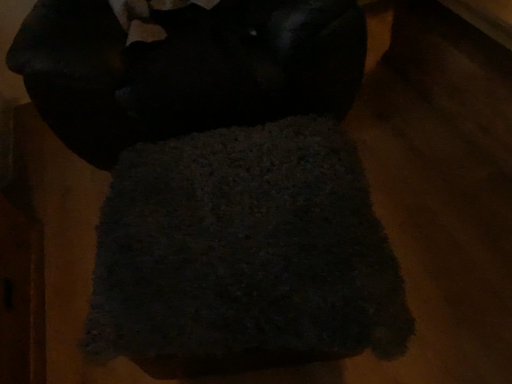
I want to click on dark textured towel at center, so click(x=243, y=255).

Describe the element at coordinates (243, 255) in the screenshot. I see `dark textured towel at center` at that location.

Where is `dark wool rug at center`? This screenshot has height=384, width=512. dark wool rug at center is located at coordinates (185, 67).

What do you see at coordinates (185, 67) in the screenshot?
I see `dark wool rug at center` at bounding box center [185, 67].

Image resolution: width=512 pixels, height=384 pixels. What are the coordinates of `dark textured towel at center` in the screenshot? It's located at (243, 255).

Is dark wool rug at center to the right of dark textured towel at center from the viewer's perspective?

In fact, dark wool rug at center is to the left of dark textured towel at center.

Which object is further away from the camera, dark wool rug at center or dark textured towel at center?

dark wool rug at center is behind.

Which is more distant, (115, 144) or (296, 297)?

The point (115, 144) is farther from the camera.

From the image's perspective, is dark wool rug at center positioned above or below dark textured towel at center?

dark wool rug at center is above dark textured towel at center.

From a real-world perspective, is dark wool rug at center positioned over dark textured towel at center based on gravity?

Correct, in the physical world, dark wool rug at center is higher than dark textured towel at center.

Does dark wool rug at center have a greater width compared to dark textured towel at center?

Yes, dark wool rug at center is wider than dark textured towel at center.

Is dark wool rug at center taller or shorter than dark textured towel at center?

dark wool rug at center is taller than dark textured towel at center.

Considering the sizes of objects dark wool rug at center and dark textured towel at center in the image provided, who is smaller, dark wool rug at center or dark textured towel at center?

dark textured towel at center.

Is dark wool rug at center inside or outside of dark textured towel at center?

The correct answer is: outside.

Is dark wool rug at center in contact with dark textured towel at center?

There is a gap between dark wool rug at center and dark textured towel at center.

Is dark wool rug at center positioned with its back to dark textured towel at center?

No, dark wool rug at center's orientation is not away from dark textured towel at center.

The width and height of the screenshot is (512, 384). There is a dark textured towel at center. Find the location of `wool above it (from a real-world perspective)`. wool above it (from a real-world perspective) is located at coordinates (185, 67).

Is dark textured towel at center to the right of dark wool rug at center from the viewer's perspective?

Indeed, dark textured towel at center is positioned on the right side of dark wool rug at center.

Relative to dark wool rug at center, is dark textured towel at center in front or behind?

dark textured towel at center is positioned closer to the viewer than dark wool rug at center.

Does point (124, 227) lie in front of point (216, 35)?

Yes, it is in front of point (216, 35).

From the image's perspective, is dark textured towel at center over dark wool rug at center?

No, from the image's perspective, dark textured towel at center is not over dark wool rug at center.

From the picture: From a real-world perspective, is dark textured towel at center physically below dark wool rug at center?

Yes.

Considering the relative sizes of dark textured towel at center and dark wool rug at center in the image provided, is dark textured towel at center thinner than dark wool rug at center?

Yes.

From their relative heights in the image, would you say dark textured towel at center is taller or shorter than dark wool rug at center?

In the image, dark textured towel at center appears to be shorter than dark wool rug at center.

Based on the photo, who is bigger, dark textured towel at center or dark wool rug at center?

dark wool rug at center is bigger.

Choose the correct answer: Is dark textured towel at center inside dark wool rug at center or outside it?

dark textured towel at center is spatially situated outside dark wool rug at center.

Is dark textured towel at center far from dark wool rug at center?

Actually, dark textured towel at center and dark wool rug at center are a little close together.

Does dark textured towel at center turn towards dark wool rug at center?

No.

How many degrees apart are the facing directions of dark textured towel at center and dark wool rug at center?

7.7 degrees separate the facing orientations of dark textured towel at center and dark wool rug at center.

How far apart are dark textured towel at center and dark wool rug at center?

dark textured towel at center is 21.54 inches from dark wool rug at center.

Where is `wool above the dark textured towel at center (from the image's perspective)`? wool above the dark textured towel at center (from the image's perspective) is located at coordinates (185, 67).

This screenshot has width=512, height=384. I want to click on wool behind the dark textured towel at center, so click(x=185, y=67).

You are a GUI agent. You are given a task and a screenshot of the screen. Output one action in this format:
    pyautogui.click(x=<x>, y=<y>)
    Task: Click on the towel that is in front of the dark wool rug at center
    The height and width of the screenshot is (384, 512).
    Given the screenshot: What is the action you would take?
    pyautogui.click(x=243, y=255)